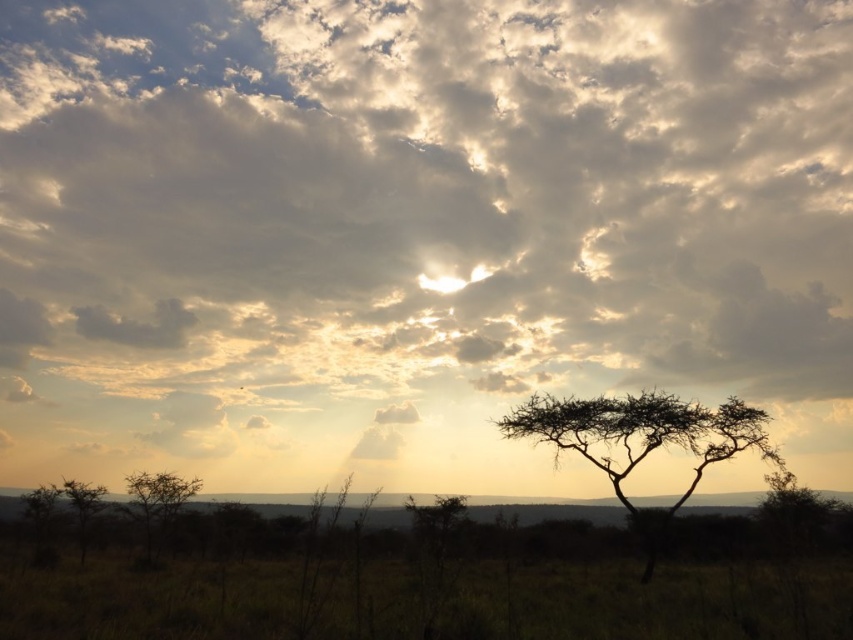
From the picture: Who is more forward, (526, 429) or (148, 504)?

Point (526, 429)

Is point (612, 472) positioned before point (152, 499)?

Yes.

Who is more distant from viewer, (x=688, y=417) or (x=157, y=509)?

The point (x=157, y=509) is more distant.

Where is `silhouette wood tree at center`? silhouette wood tree at center is located at coordinates (642, 438).